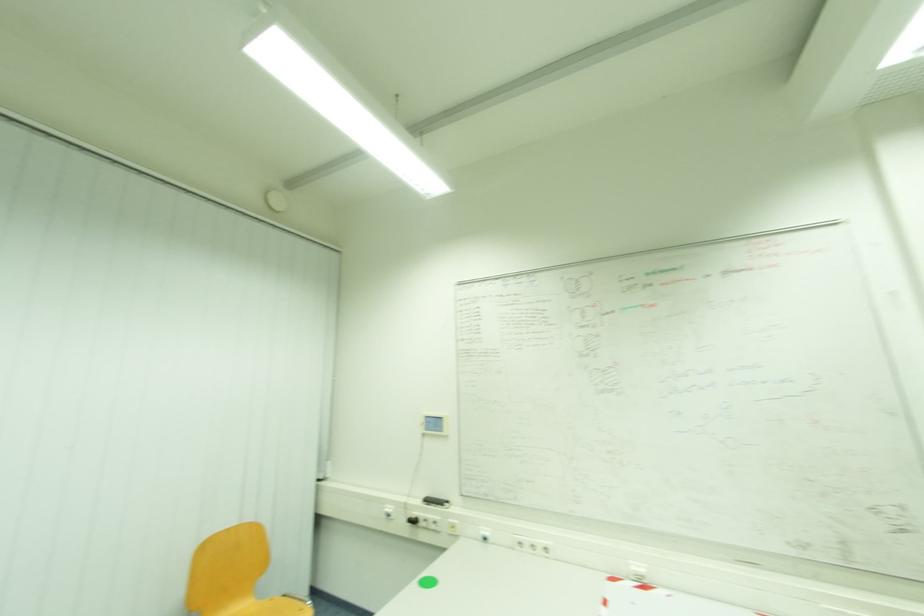
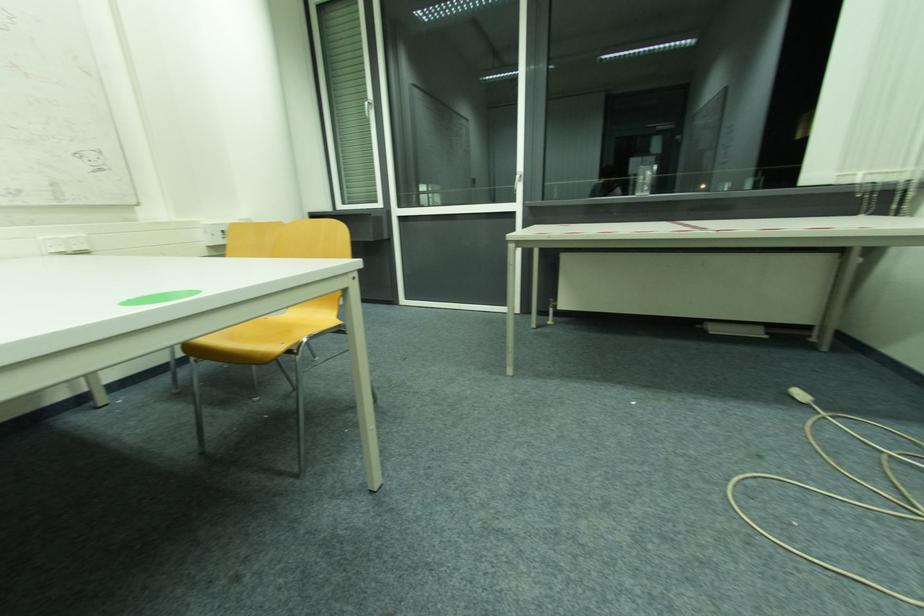
Question: The images are taken continuously from a first-person perspective. In which direction is your viewpoint rotating?

Choices:
 (A) Left
 (B) Right
 (C) Up
 (D) Down

Answer: (B)